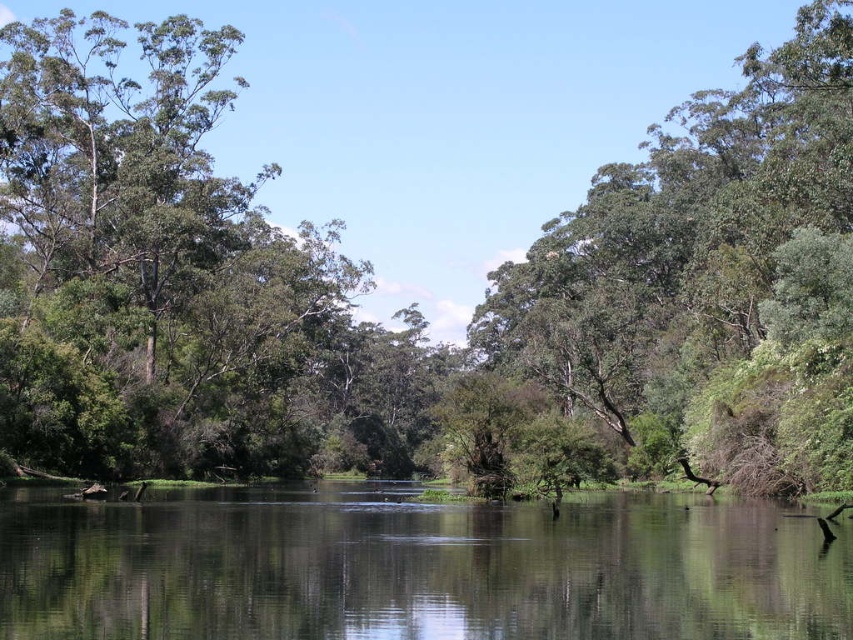
Question: Can you confirm if clear water at center is positioned below green leafy tree at center?

Choices:
 (A) no
 (B) yes

Answer: (B)

Question: Based on their relative distances, which object is nearer to the green leafy tree at left?

Choices:
 (A) green leafy tree at center
 (B) clear water at center

Answer: (A)

Question: Considering the real-world distances, which object is farthest from the clear water at center?

Choices:
 (A) green leafy tree at center
 (B) green leafy tree at left

Answer: (B)

Question: Is green leafy tree at left smaller than green leafy tree at center?

Choices:
 (A) no
 (B) yes

Answer: (A)

Question: Based on their relative distances, which object is nearer to the green leafy tree at center?

Choices:
 (A) clear water at center
 (B) green leafy tree at left

Answer: (B)

Question: Can you confirm if green leafy tree at left is smaller than clear water at center?

Choices:
 (A) yes
 (B) no

Answer: (B)